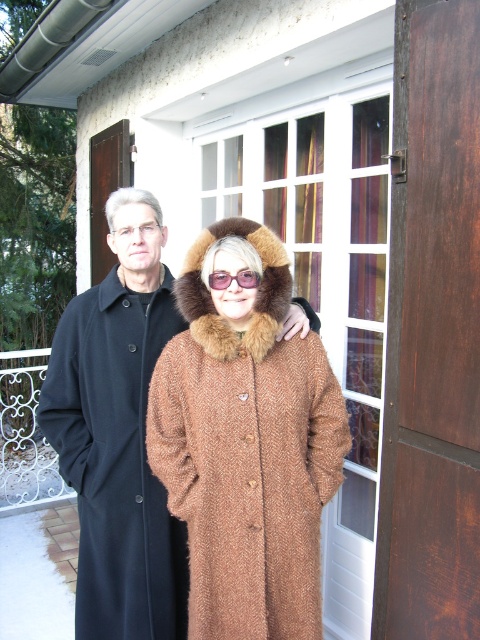
Based on the photo, is brown wool coat at center bigger than black wool coat at left?

Incorrect, brown wool coat at center is not larger than black wool coat at left.

Is brown wool coat at center wider than black wool coat at left?

Yes, brown wool coat at center is wider than black wool coat at left.

This screenshot has width=480, height=640. Identify the location of brown wool coat at center. coord(245,442).

Locate an element on the screen. This screenshot has height=640, width=480. brown wool coat at center is located at coordinates (245, 442).

Which is more to the right, brown wool coat at center or pink plastic goggles at center?

brown wool coat at center is more to the right.

Is point (240, 324) positioned in front of point (208, 284)?

No, it is not.

Measure the distance between point (200, 289) and camera.

The distance of point (200, 289) from camera is 6.27 feet.

The width and height of the screenshot is (480, 640). In order to click on brown wool coat at center in this screenshot , I will do `click(245, 442)`.

Is black wool coat at left wider than pink plastic goggles at center?

Yes, black wool coat at left is wider than pink plastic goggles at center.

Can you confirm if black wool coat at left is positioned to the right of pink plastic goggles at center?

In fact, black wool coat at left is to the left of pink plastic goggles at center.

Which is in front, point (72, 355) or point (223, 284)?

Positioned in front is point (223, 284).

Locate an element on the screen. The height and width of the screenshot is (640, 480). black wool coat at left is located at coordinates (119, 435).